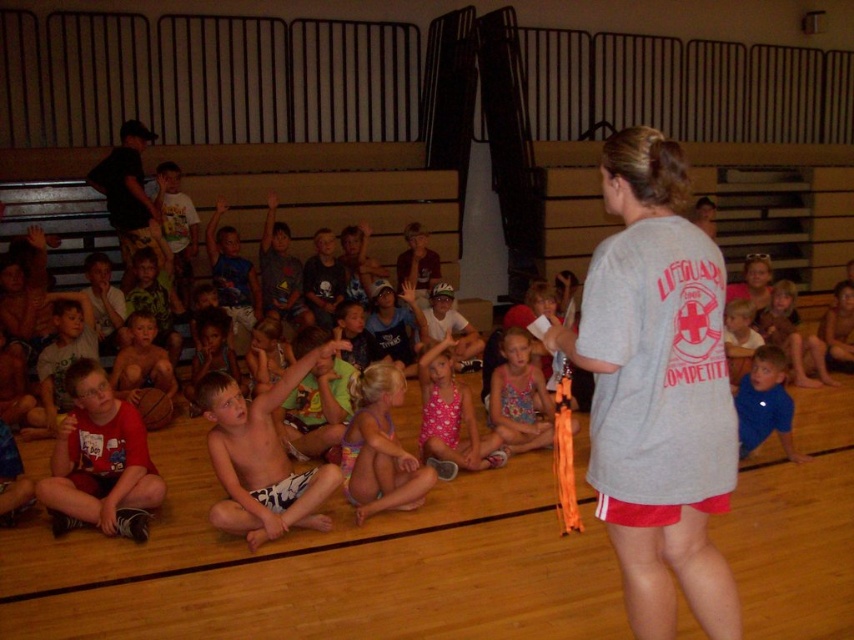
Does pink floral swimsuit at center lie in front of gray cotton shirt at center?

A: Yes, pink floral swimsuit at center is in front of gray cotton shirt at center.

Between point (451, 448) and point (279, 234), which one is positioned behind?

The point (279, 234) is behind.

Describe the element at coordinates (452, 417) in the screenshot. Image resolution: width=854 pixels, height=640 pixels. I see `pink floral swimsuit at center` at that location.

You are a GUI agent. You are given a task and a screenshot of the screen. Output one action in this format:
    pyautogui.click(x=<x>, y=<y>)
    Task: Click on the pink floral swimsuit at center
    
    Given the screenshot: What is the action you would take?
    pyautogui.click(x=452, y=417)

Is point (97, 381) positioned after point (759, 410)?

That is False.

Does red cotton shirt at lower left appear on the right side of blue cotton shirt at lower right?

In fact, red cotton shirt at lower left is to the left of blue cotton shirt at lower right.

Where is `red cotton shirt at lower left`? This screenshot has width=854, height=640. red cotton shirt at lower left is located at coordinates (98, 458).

Measure the distance from pink fabric swimsuit at center to matte black t-shirt at center.

pink fabric swimsuit at center and matte black t-shirt at center are 3.50 meters apart.

Does pink fabric swimsuit at center appear on the right side of matte black t-shirt at center?

Correct, you'll find pink fabric swimsuit at center to the right of matte black t-shirt at center.

This screenshot has width=854, height=640. What are the coordinates of `pink fabric swimsuit at center` in the screenshot? It's located at (379, 448).